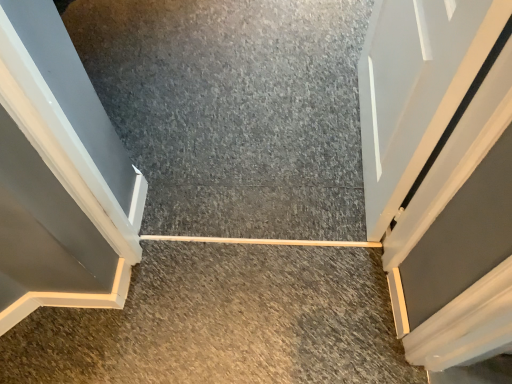
The width and height of the screenshot is (512, 384). Describe the element at coordinates (234, 111) in the screenshot. I see `smooth concrete at center, the 2th concrete viewed from the front` at that location.

Identify the location of smooth concrete at center, the 2th concrete viewed from the front. Image resolution: width=512 pixels, height=384 pixels. (234, 111).

Describe the element at coordinates (415, 88) in the screenshot. This screenshot has width=512, height=384. I see `white glossy door at upper right` at that location.

The height and width of the screenshot is (384, 512). What are the coordinates of `smooth concrete at center, the 1th concrete positioned from the top` in the screenshot? It's located at (234, 111).

Identify the location of door above the smooth concrete at center, the second concrete positioned from the back (from the image's perspective). (415, 88).

Which object is further away from the camera taking this photo, smooth concrete at center, the 1th concrete positioned from the front, or white glossy door at upper right?

smooth concrete at center, the 1th concrete positioned from the front, is more distant.

Which object is further away from the camera, white glossy door at upper right or smooth concrete at center, acting as the first concrete starting from the back?

smooth concrete at center, acting as the first concrete starting from the back, is behind.

Between white glossy door at upper right and smooth concrete at center, the second concrete positioned from the bottom, which one has smaller size?

white glossy door at upper right.

Is point (394, 101) more distant than point (279, 76)?

No, (394, 101) is in front of (279, 76).

From a real-world perspective, which is physically below, white glossy door at upper right or smooth concrete at center, the second concrete positioned from the bottom?

smooth concrete at center, the second concrete positioned from the bottom, from a real-world perspective.

Which of these two, smooth concrete at center, the 2th concrete viewed from the front, or white glossy door at upper right, is bigger?

smooth concrete at center, the 2th concrete viewed from the front.

From the picture: Is smooth concrete at center, the second concrete positioned from the bottom, facing away from white glossy door at upper right?

smooth concrete at center, the second concrete positioned from the bottom, is not turned away from white glossy door at upper right.

Is the surface of smooth concrete at center, the second concrete positioned from the bottom, in direct contact with white glossy door at upper right?

No, smooth concrete at center, the second concrete positioned from the bottom, is not next to white glossy door at upper right.

Which is more to the left, smooth concrete at center, acting as the first concrete starting from the back, or smooth concrete at center, the 1th concrete positioned from the front?

smooth concrete at center, the 1th concrete positioned from the front, is more to the left.

Does smooth concrete at center, the second concrete positioned from the bottom, have a lesser height compared to smooth concrete at center, the 1th concrete positioned from the front?

Correct, smooth concrete at center, the second concrete positioned from the bottom, is not as tall as smooth concrete at center, the 1th concrete positioned from the front.

Could you tell me if smooth concrete at center, the 2th concrete viewed from the front, is turned towards smooth concrete at center, acting as the 1th concrete starting from the bottom?

No, smooth concrete at center, the 2th concrete viewed from the front, is not aimed at smooth concrete at center, acting as the 1th concrete starting from the bottom.

Considering the sizes of objects smooth concrete at center, the 1th concrete positioned from the top, and smooth concrete at center, which is the 2th concrete from top to bottom, in the image provided, who is wider, smooth concrete at center, the 1th concrete positioned from the top, or smooth concrete at center, which is the 2th concrete from top to bottom,?

smooth concrete at center, the 1th concrete positioned from the top.

Does smooth concrete at center, acting as the 1th concrete starting from the bottom, have a lesser width compared to smooth concrete at center, acting as the first concrete starting from the back?

Indeed, smooth concrete at center, acting as the 1th concrete starting from the bottom, has a lesser width compared to smooth concrete at center, acting as the first concrete starting from the back.

Considering the relative sizes of smooth concrete at center, acting as the 1th concrete starting from the bottom, and smooth concrete at center, the second concrete positioned from the bottom, in the image provided, is smooth concrete at center, acting as the 1th concrete starting from the bottom, shorter than smooth concrete at center, the second concrete positioned from the bottom,?

No, smooth concrete at center, acting as the 1th concrete starting from the bottom, is not shorter than smooth concrete at center, the second concrete positioned from the bottom.

From the image's perspective, which one is positioned lower, smooth concrete at center, acting as the 1th concrete starting from the bottom, or smooth concrete at center, the second concrete positioned from the bottom?

From the image's view, smooth concrete at center, acting as the 1th concrete starting from the bottom, is below.

How distant is smooth concrete at center, acting as the 1th concrete starting from the bottom, from smooth concrete at center, the 2th concrete viewed from the front?

The distance of smooth concrete at center, acting as the 1th concrete starting from the bottom, from smooth concrete at center, the 2th concrete viewed from the front, is 54.59 centimeters.

Is smooth concrete at center, the second concrete positioned from the back, surrounded by white glossy door at upper right?

No, smooth concrete at center, the second concrete positioned from the back, is located outside of white glossy door at upper right.

From the image's perspective, between white glossy door at upper right and smooth concrete at center, which is the 2th concrete from top to bottom, which one is located above?

white glossy door at upper right.

From a real-world perspective, is white glossy door at upper right above or below smooth concrete at center, the second concrete positioned from the back?

Clearly, from a real-world perspective, white glossy door at upper right is above smooth concrete at center, the second concrete positioned from the back.

The height and width of the screenshot is (384, 512). In order to click on concrete that is the 2nd object to the left of the white glossy door at upper right, starting at the anchor in this screenshot , I will do `click(223, 322)`.

Identify the location of door located on the right of smooth concrete at center, the 2th concrete viewed from the front. (415, 88).

Which object lies nearer to the anchor point white glossy door at upper right, smooth concrete at center, which is the 2th concrete from top to bottom, or smooth concrete at center, the 2th concrete viewed from the front?

smooth concrete at center, the 2th concrete viewed from the front, is closer to white glossy door at upper right.

Considering their positions, is smooth concrete at center, acting as the 1th concrete starting from the bottom, positioned closer to smooth concrete at center, acting as the first concrete starting from the back, than white glossy door at upper right?

smooth concrete at center, acting as the 1th concrete starting from the bottom, lies closer to smooth concrete at center, acting as the first concrete starting from the back, than the other object.

Based on their spatial positions, is white glossy door at upper right or smooth concrete at center, which is the 2th concrete from top to bottom, further from smooth concrete at center, acting as the first concrete starting from the back?

white glossy door at upper right lies further to smooth concrete at center, acting as the first concrete starting from the back, than the other object.

When comparing their distances from white glossy door at upper right, does smooth concrete at center, the 2th concrete viewed from the front, or smooth concrete at center, the second concrete positioned from the back, seem closer?

smooth concrete at center, the 2th concrete viewed from the front.

Estimate the real-world distances between objects in this image. Which object is further from smooth concrete at center, which is the 2th concrete from top to bottom, white glossy door at upper right or smooth concrete at center, the 2th concrete viewed from the front?

The object further to smooth concrete at center, which is the 2th concrete from top to bottom, is white glossy door at upper right.

From the image, which object appears to be farther from smooth concrete at center, acting as the 1th concrete starting from the bottom, smooth concrete at center, acting as the first concrete starting from the back, or white glossy door at upper right?

The object further to smooth concrete at center, acting as the 1th concrete starting from the bottom, is white glossy door at upper right.

Find the location of a particular element. Image resolution: width=512 pixels, height=384 pixels. door between smooth concrete at center, the 1th concrete positioned from the top, and smooth concrete at center, the second concrete positioned from the back, in the up-down direction is located at coordinates (415, 88).